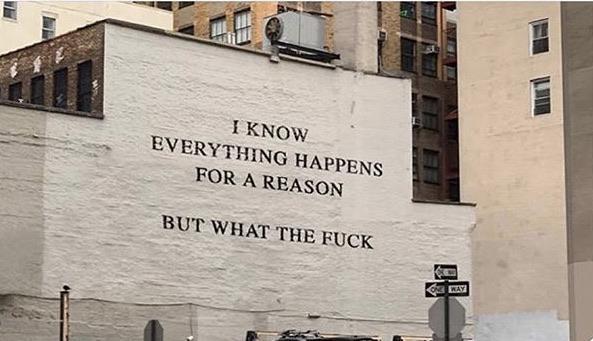
Locate an element on the screen. The height and width of the screenshot is (341, 593). text painted on wall is located at coordinates (267, 150), (264, 229).